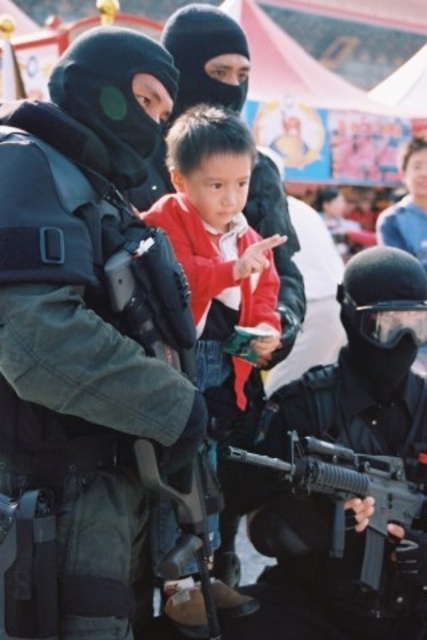
Question: Which point is closer to the camera?

Choices:
 (A) (233, 166)
 (B) (380, 490)
 (C) (31, 200)

Answer: (C)

Question: Can you confirm if matte black tactical vest at center is bigger than red matte jacket at center?

Choices:
 (A) yes
 (B) no

Answer: (A)

Question: Which point is closer to the camera?

Choices:
 (A) (397, 476)
 (B) (146, 244)
 (C) (245, 291)

Answer: (B)

Question: Where is matte black tactical vest at center located in relation to red matte jacket at center in the image?

Choices:
 (A) left
 (B) right

Answer: (A)

Question: Which point is farther from the camera taking this photo?

Choices:
 (A) (242, 225)
 (B) (307, 486)
 (C) (32, 365)

Answer: (A)

Question: Does matte black tactical vest at center have a larger size compared to matte black rifle at lower center?

Choices:
 (A) no
 (B) yes

Answer: (B)